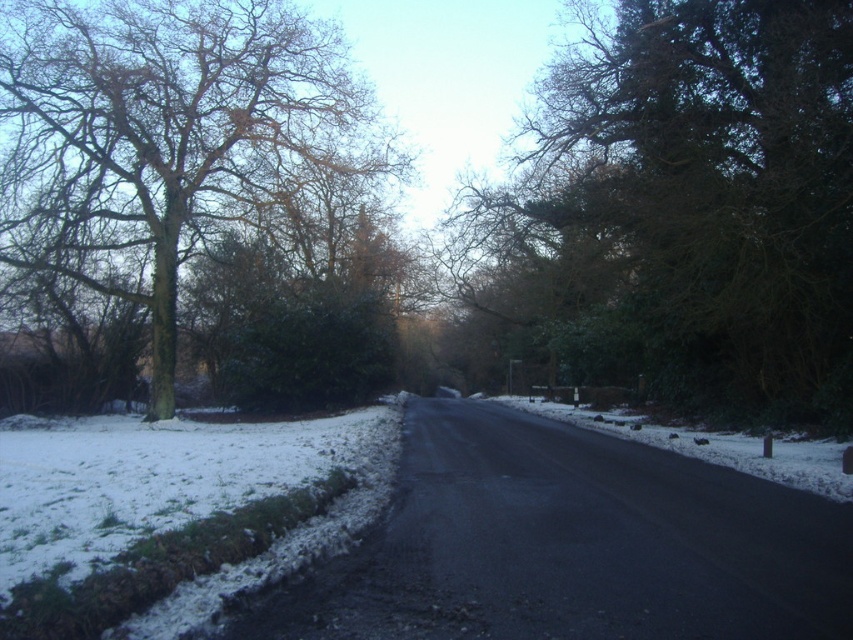
Question: Does green leafy tree at center come behind green leafy tree at left?

Choices:
 (A) yes
 (B) no

Answer: (B)

Question: Where is green leafy tree at center located in relation to white fluffy snow at lower left in the image?

Choices:
 (A) left
 (B) right

Answer: (B)

Question: Which object is farther from the camera taking this photo?

Choices:
 (A) white fluffy snow at lower left
 (B) green leafy tree at center

Answer: (B)

Question: Does green leafy tree at center have a smaller size compared to green leafy tree at left?

Choices:
 (A) yes
 (B) no

Answer: (B)

Question: Which point appears closest to the camera in this image?

Choices:
 (A) (107, 497)
 (B) (161, 64)
 (C) (633, 333)

Answer: (A)

Question: Which of the following is the closest to the observer?

Choices:
 (A) green leafy tree at left
 (B) green leafy tree at center

Answer: (B)